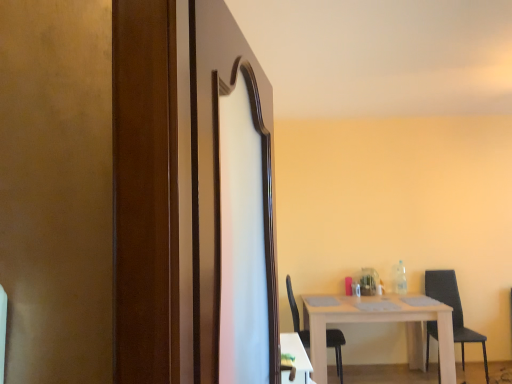
Question: Considering the positions of wooden screen door at center and black matte chair at lower right, the 1th chair when ordered from left to right, in the image, is wooden screen door at center wider or thinner than black matte chair at lower right, the 1th chair when ordered from left to right,?

Choices:
 (A) wide
 (B) thin

Answer: (B)

Question: Considering the relative positions of wooden screen door at center and black matte chair at lower right, the 1th chair when ordered from left to right, in the image provided, is wooden screen door at center to the left or to the right of black matte chair at lower right, the 1th chair when ordered from left to right,?

Choices:
 (A) left
 (B) right

Answer: (A)

Question: Which of these objects is positioned closest to the white wooden table at center, positioned as the 2th table in front-to-back order?

Choices:
 (A) black matte chair at lower right, the 1th chair when ordered from left to right
 (B) white glossy table at lower right, the 1th table viewed from the left
 (C) black fabric chair at right, which is the 1th chair in right-to-left order
 (D) wooden screen door at center

Answer: (A)

Question: Estimate the real-world distances between objects in this image. Which object is closer to the black matte chair at lower right, the 1th chair when ordered from left to right?

Choices:
 (A) white glossy table at lower right, the 1th table when ordered from front to back
 (B) black fabric chair at right, which is the 1th chair in right-to-left order
 (C) wooden screen door at center
 (D) white wooden table at center, positioned as the 1th table in back-to-front order

Answer: (D)